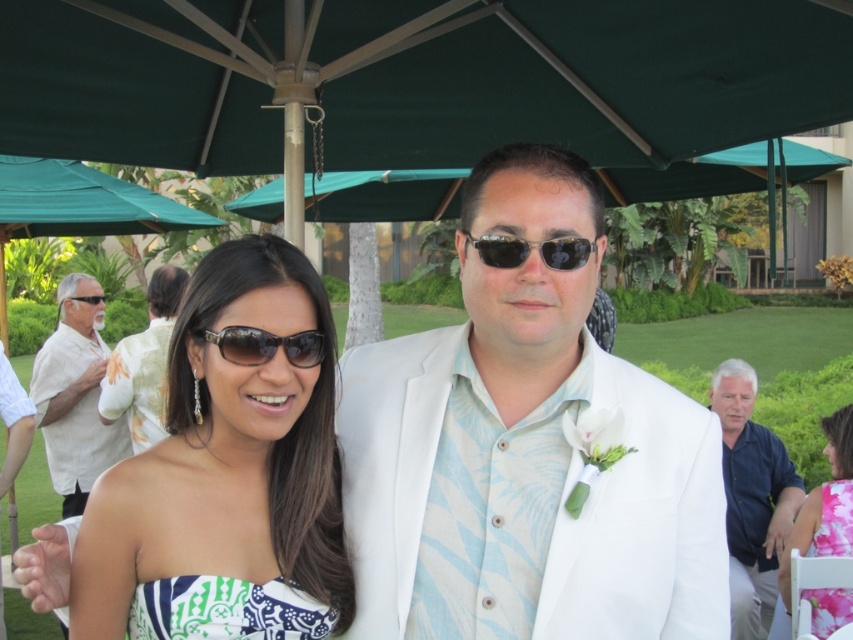
You are taking a photo of the green fabric umbrella at upper center and the pink floral dress at lower right. Which object should you focus on first to ensure it appears larger in the photo?

A: The green fabric umbrella at upper center is closer to the viewer than the pink floral dress at lower right, so focusing on it first will make it appear larger in the photo.

You are taking a photo of the scene and want to focus on both the point at (718, 67) and the point at (848, 410). Which point should you adjust your focus to first to ensure both are in clear view?

You should focus on point (718, 67) first because it is closer to the camera than point (848, 410), allowing for better depth of field coverage of both points.

You are standing in the garden and want to locate the dark blue shirt at right. According to the coordinates provided, where should you look?

You should look at point 0.780 on the x axis and 0.883 on the y axis to locate the dark blue shirt at right.